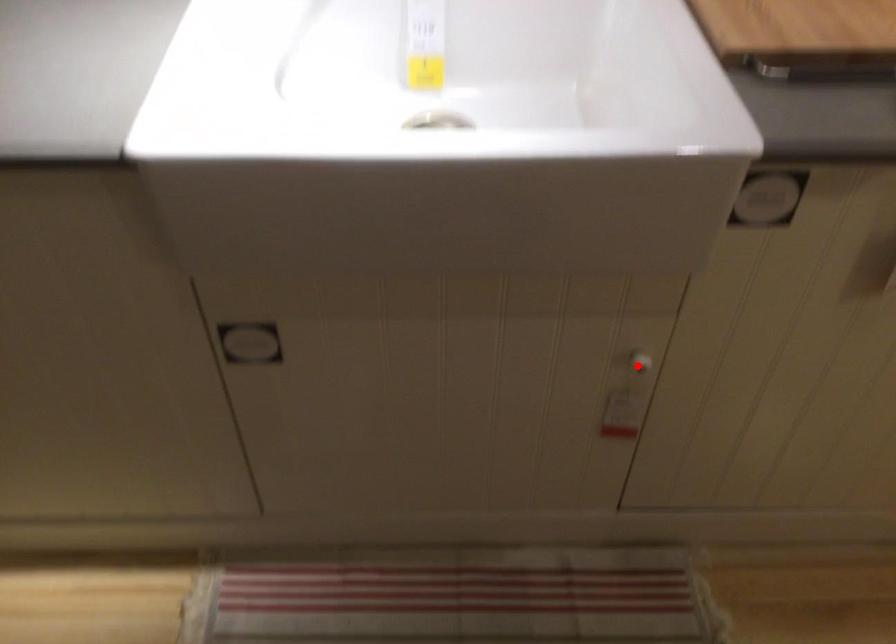
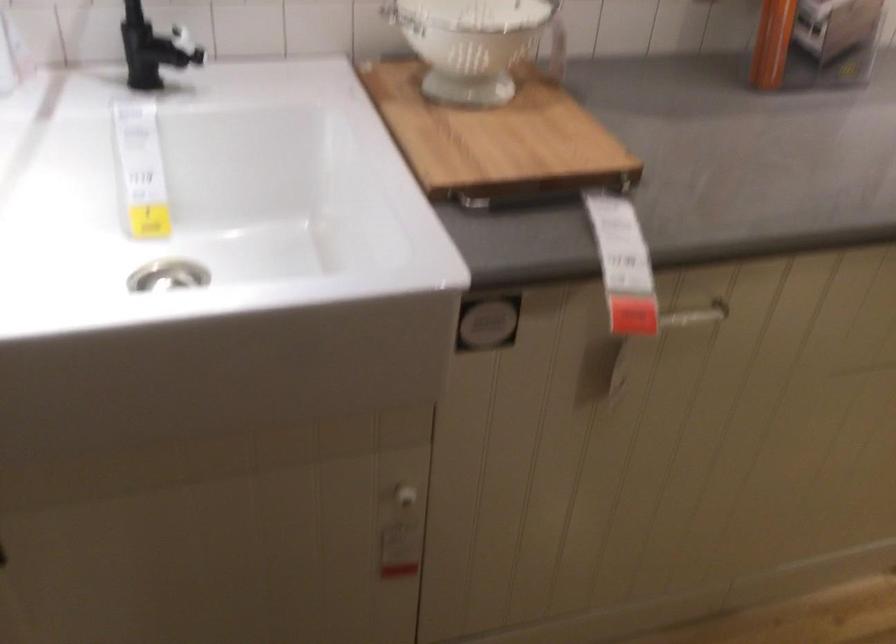
Question: I am providing you with two images of the same scene from different viewpoints. A red point is marked on the first image. Can you still see the location of the red point in image 2?

Choices:
 (A) Yes
 (B) No

Answer: (A)